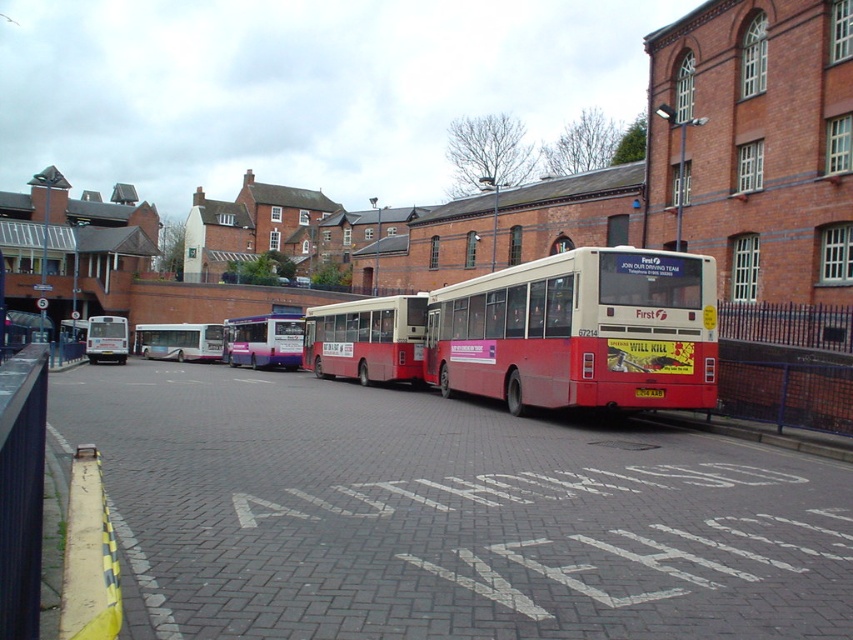
Question: Does red matte bus at center have a greater width compared to purple glossy bus at center?

Choices:
 (A) yes
 (B) no

Answer: (B)

Question: Which of the following is the closest to the observer?

Choices:
 (A) (358, 369)
 (B) (654, 388)
 (C) (206, 348)
 (D) (70, 490)

Answer: (D)

Question: In this image, where is white matte bus at center located relative to white glossy bus at left?

Choices:
 (A) above
 (B) below

Answer: (B)

Question: Is purple glossy bus at center further to camera compared to yellow matte license plate at center?

Choices:
 (A) no
 (B) yes

Answer: (B)

Question: Which of these objects is positioned closest to the white glossy bus at left?

Choices:
 (A) white matte bus at left
 (B) yellow painted concrete curb at lower left

Answer: (A)

Question: Considering the real-world distances, which object is farthest from the white glossy bus at left?

Choices:
 (A) white matte bus at left
 (B) yellow matte license plate at center

Answer: (B)